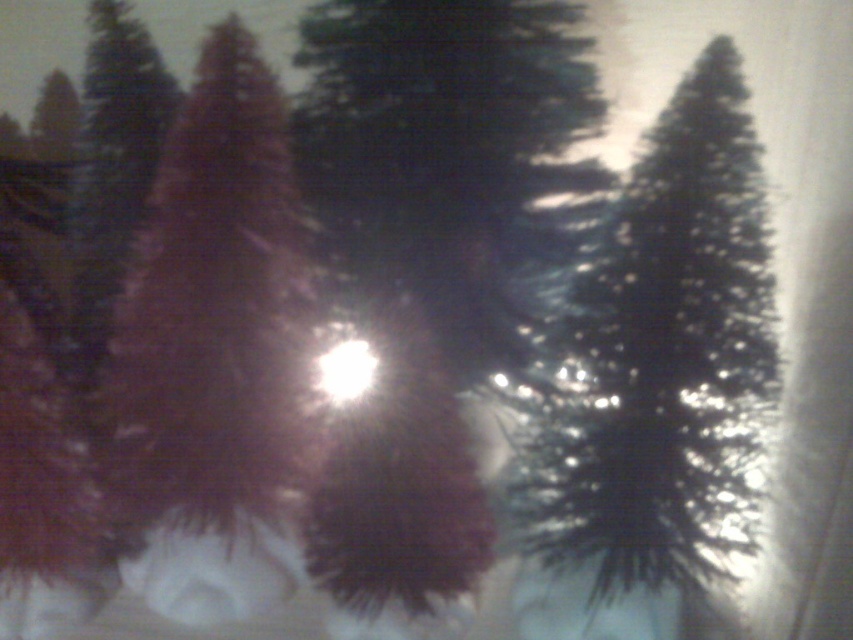
Is shiny metallic fir tree at upper right closer to camera compared to shiny red fir tree at left?

That is True.

Describe the element at coordinates (664, 358) in the screenshot. I see `shiny metallic fir tree at upper right` at that location.

Where is `shiny metallic fir tree at upper right`? This screenshot has width=853, height=640. shiny metallic fir tree at upper right is located at coordinates (664, 358).

Which is more to the left, green matte tree at center or matte red fir tree at center?

matte red fir tree at center is more to the left.

Between green matte tree at center and matte red fir tree at center, which one has less height?

matte red fir tree at center is shorter.

Find the location of `green matte tree at center`. green matte tree at center is located at coordinates (430, 252).

Can you confirm if green matte tree at center is wider than shiny metallic fir tree at upper right?

Indeed, green matte tree at center has a greater width compared to shiny metallic fir tree at upper right.

Identify the location of green matte tree at center. (430, 252).

Find the location of a particular element. The width and height of the screenshot is (853, 640). green matte tree at center is located at coordinates (430, 252).